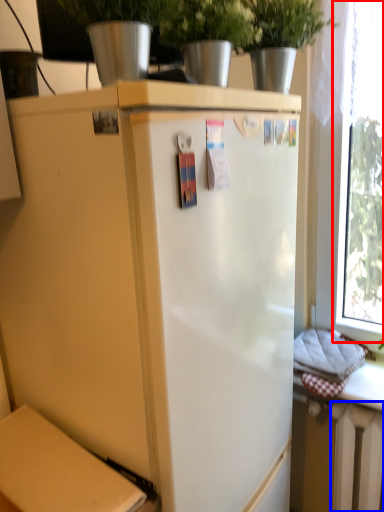
Question: Which object is further to the camera taking this photo, window (highlighted by a red box) or radiator (highlighted by a blue box)?

Choices:
 (A) window
 (B) radiator

Answer: (B)